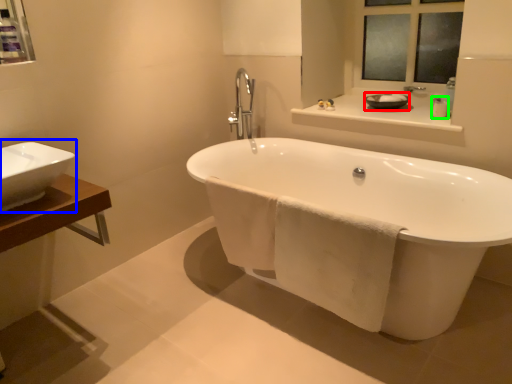
Question: Which object is the farthest from basin (highlighted by a red box)? Choose among these: sink (highlighted by a blue box) or toiletry (highlighted by a green box).

Choices:
 (A) sink
 (B) toiletry

Answer: (A)